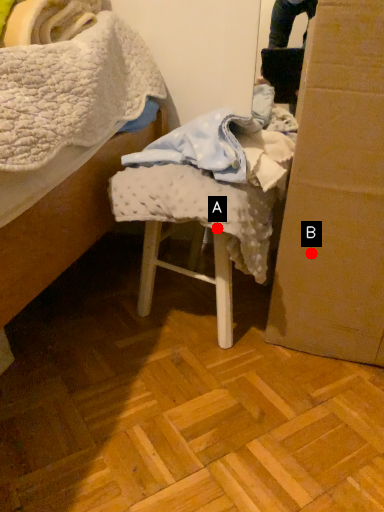
Question: Two points are circled on the image, labeled by A and B beside each circle. Which of the following is the closest to the observer?

Choices:
 (A) A is closer
 (B) B is closer

Answer: (A)